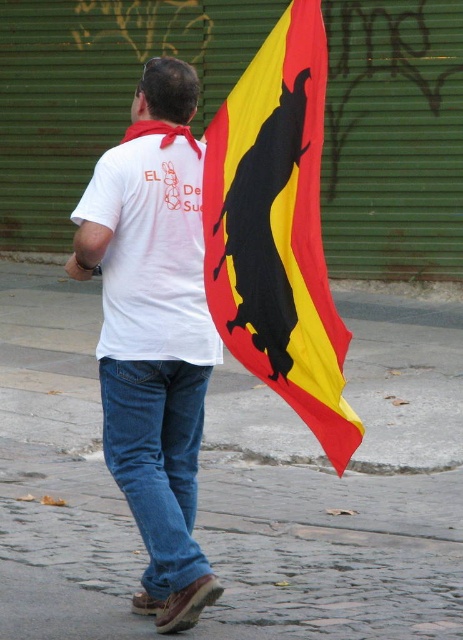
Between cobblestone pavement at center and white cotton t-shirt at back, which one has more height?

white cotton t-shirt at back is taller.

Locate an element on the screen. cobblestone pavement at center is located at coordinates (342, 492).

The image size is (463, 640). I want to click on white cotton t-shirt at back, so click(151, 252).

Is point (131, 280) farther from camera compared to point (152, 362)?

No, it is in front of (152, 362).

In order to click on white cotton t-shirt at back in this screenshot , I will do `click(151, 252)`.

Between white cotton shirt at center and yellow fabric flag at center, which one is positioned higher?

yellow fabric flag at center

From the picture: Who is taller, white cotton shirt at center or yellow fabric flag at center?

Standing taller between the two is white cotton shirt at center.

Between point (186, 472) and point (286, 280), which one is positioned in front?

Point (286, 280) is in front.

You are a GUI agent. You are given a task and a screenshot of the screen. Output one action in this format:
    pyautogui.click(x=<x>, y=<y>)
    Task: Click on the white cotton shirt at center
    The height and width of the screenshot is (640, 463).
    Given the screenshot: What is the action you would take?
    154,332